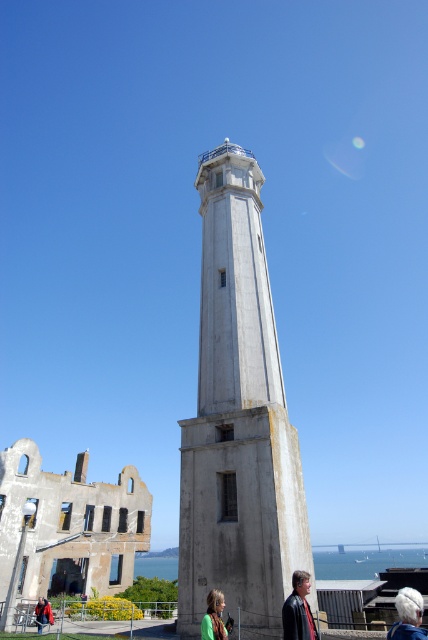
Question: Does black leather jacket at lower right appear under white hair at lower right?

Choices:
 (A) yes
 (B) no

Answer: (B)

Question: Which of the following is the farthest from the observer?

Choices:
 (A) (216, 449)
 (B) (412, 608)

Answer: (A)

Question: Which point is farther from the camera taking this photo?

Choices:
 (A) (220, 621)
 (B) (300, 580)

Answer: (B)

Question: Can you confirm if white concrete tower at center is bigger than black leather jacket at lower right?

Choices:
 (A) no
 (B) yes

Answer: (B)

Question: Is black leather jacket at lower right bigger than white hair at lower right?

Choices:
 (A) yes
 (B) no

Answer: (B)

Question: Which point is closer to the camera?

Choices:
 (A) (293, 621)
 (B) (240, 227)
 (C) (406, 588)

Answer: (A)